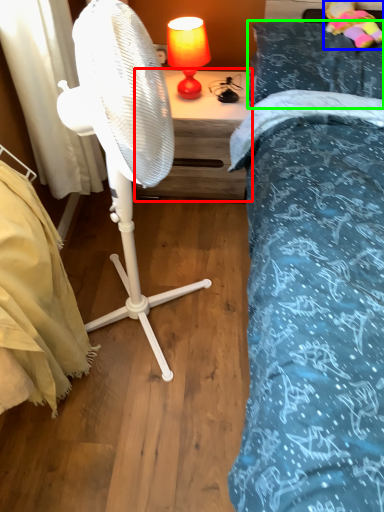
Question: Which is nearer to the nightstand (highlighted by a red box)? toy (highlighted by a blue box) or pillow (highlighted by a green box).

Choices:
 (A) toy
 (B) pillow

Answer: (B)